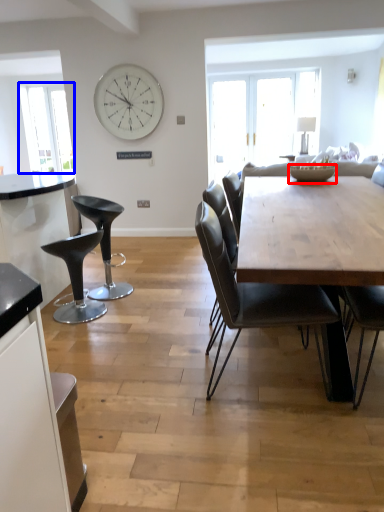
Question: Which object is closer to the camera taking this photo, bowl (highlighted by a red box) or window screen (highlighted by a blue box)?

Choices:
 (A) bowl
 (B) window screen

Answer: (A)